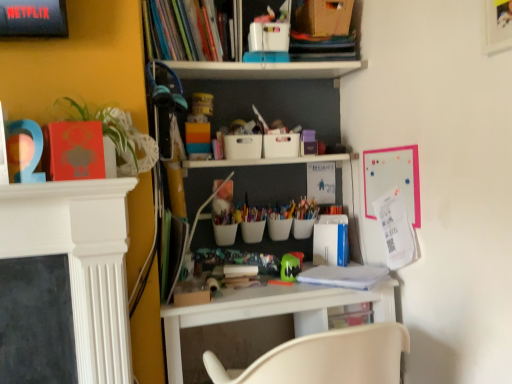
Image resolution: width=512 pixels, height=384 pixels. What do you see at coordinates (106, 126) in the screenshot?
I see `green leafy plant at left` at bounding box center [106, 126].

Describe the element at coordinates (344, 276) in the screenshot. I see `white paper at center, positioned as the 1th book in right-to-left order` at that location.

Where is `white plastic desk at center`? white plastic desk at center is located at coordinates (272, 311).

Is hardcover books at upper center, which ranks as the second book in bottom-to-top order, inside or outside of green rubber toy at center?

The correct answer is: outside.

Considering the sizes of objects hardcover books at upper center, which ranks as the second book in bottom-to-top order, and green rubber toy at center in the image provided, who is bigger, hardcover books at upper center, which ranks as the second book in bottom-to-top order, or green rubber toy at center?

With larger size is hardcover books at upper center, which ranks as the second book in bottom-to-top order.

Between point (207, 58) and point (288, 280), which one is positioned in front?

The point (288, 280) is in front.

Is hardcover books at upper center, which is the first book from left to right, taller or shorter than green rubber toy at center?

Clearly, hardcover books at upper center, which is the first book from left to right, is taller compared to green rubber toy at center.

Is point (308, 269) positioned in front of point (298, 263)?

No, it is not.

Based on the photo, from the image's perspective, which one is positioned lower, white paper at center, the second book from the left, or green rubber toy at center?

white paper at center, the second book from the left, from the image's perspective.

Is white paper at center, positioned as the 1th book in right-to-left order, smaller than green rubber toy at center?

No, white paper at center, positioned as the 1th book in right-to-left order, is not smaller than green rubber toy at center.

Considering the sizes of objects green leafy plant at left and hardcover books at upper center, which is the 1th book from top to bottom, in the image provided, who is smaller, green leafy plant at left or hardcover books at upper center, which is the 1th book from top to bottom,?

Smaller between the two is green leafy plant at left.

Is green leafy plant at left oriented towards hardcover books at upper center, which is the second book in right-to-left order?

No.

Can you confirm if green leafy plant at left is taller than hardcover books at upper center, which is the first book from left to right?

Incorrect, the height of green leafy plant at left is not larger of that of hardcover books at upper center, which is the first book from left to right.

Does green leafy plant at left have a greater width compared to hardcover books at upper center, which is the 1th book from top to bottom?

No.

Considering the sizes of objects white paper at center, which is the second book in top-to-bottom order, and green leafy plant at left in the image provided, who is wider, white paper at center, which is the second book in top-to-bottom order, or green leafy plant at left?

white paper at center, which is the second book in top-to-bottom order, is wider.

Is white paper at center, which is the second book in top-to-bottom order, further to camera compared to green leafy plant at left?

Yes, white paper at center, which is the second book in top-to-bottom order, is behind green leafy plant at left.

Is white paper at center, which is the second book in top-to-bottom order, turned away from green leafy plant at left?

No, white paper at center, which is the second book in top-to-bottom order, is not facing the opposite direction of green leafy plant at left.

Is white paper at center, positioned as the 1th book in right-to-left order, with green leafy plant at left?

white paper at center, positioned as the 1th book in right-to-left order, is not next to green leafy plant at left, and they're not touching.

From the picture: Measure the distance from white plastic desk at center to white paper at center, positioned as the 1th book in right-to-left order.

A distance of 6.87 inches exists between white plastic desk at center and white paper at center, positioned as the 1th book in right-to-left order.

Can you confirm if white plastic desk at center is smaller than white paper at center, positioned as the 1th book in right-to-left order?

No, white plastic desk at center is not smaller than white paper at center, positioned as the 1th book in right-to-left order.

From a real-world perspective, is white plastic desk at center above or below white paper at center, the first book from the bottom?

Clearly, from a real-world perspective, white plastic desk at center is below white paper at center, the first book from the bottom.

From the image's perspective, which object appears higher, white plastic desk at center or white paper at center, which is the second book in top-to-bottom order?

From the image's view, white paper at center, which is the second book in top-to-bottom order, is above.

From the image's perspective, would you say green rubber toy at center is shown under white plastic desk at center?

Incorrect, from the image's perspective, green rubber toy at center is higher than white plastic desk at center.

Which is in front, point (284, 262) or point (224, 309)?

The point (224, 309) is more forward.

Image resolution: width=512 pixels, height=384 pixels. Find the location of `toy on the right of white plastic desk at center`. toy on the right of white plastic desk at center is located at coordinates point(291,266).

Based on the photo, considering the sizes of objects green rubber toy at center and white plastic desk at center in the image provided, who is smaller, green rubber toy at center or white plastic desk at center?

Smaller between the two is green rubber toy at center.

Can you tell me how much hardcover books at upper center, which is the second book in right-to-left order, and white paper at center, the second book from the left, differ in facing direction?

hardcover books at upper center, which is the second book in right-to-left order, and white paper at center, the second book from the left, are facing 41.9 degrees away from each other.

Looking at this image, is hardcover books at upper center, which is the second book in right-to-left order, looking in the opposite direction of white paper at center, which is the second book in top-to-bottom order?

No.

Does hardcover books at upper center, which is the 1th book from top to bottom, have a lesser width compared to white paper at center, which is the second book in top-to-bottom order?

Yes.

Image resolution: width=512 pixels, height=384 pixels. Find the location of `book that is above the green rubber toy at center (from the image's perspective)`. book that is above the green rubber toy at center (from the image's perspective) is located at coordinates (186, 30).

Locate an element on the screen. The image size is (512, 384). book below the green rubber toy at center (from the image's perspective) is located at coordinates (344, 276).

Looking at the image, which one is located closer to white paper at center, the first book from the bottom, green leafy plant at left or green rubber toy at center?

green rubber toy at center lies closer to white paper at center, the first book from the bottom, than the other object.

Which object lies nearer to the anchor point white plastic desk at center, hardcover books at upper center, which is the 1th book from top to bottom, or green leafy plant at left?

green leafy plant at left lies closer to white plastic desk at center than the other object.

When comparing their distances from green rubber toy at center, does hardcover books at upper center, which is the 1th book from top to bottom, or white paper at center, the second book from the left, seem closer?

white paper at center, the second book from the left, is closer to green rubber toy at center.

Considering their positions, is hardcover books at upper center, which is the second book in right-to-left order, positioned further to green rubber toy at center than green leafy plant at left?

The object further to green rubber toy at center is hardcover books at upper center, which is the second book in right-to-left order.

Based on their spatial positions, is hardcover books at upper center, which is the second book in right-to-left order, or white paper at center, the second book from the left, further from green leafy plant at left?

white paper at center, the second book from the left, lies further to green leafy plant at left than the other object.

Based on their spatial positions, is white plastic desk at center or green leafy plant at left closer to hardcover books at upper center, which ranks as the second book in bottom-to-top order?

green leafy plant at left is closer to hardcover books at upper center, which ranks as the second book in bottom-to-top order.

Looking at the image, which one is located closer to hardcover books at upper center, which is the second book in right-to-left order, white plastic desk at center or white paper at center, which is the second book in top-to-bottom order?

white plastic desk at center is positioned closer to the anchor hardcover books at upper center, which is the second book in right-to-left order.

When comparing their distances from white plastic desk at center, does white paper at center, the second book from the left, or green rubber toy at center seem further?

green rubber toy at center is positioned further to the anchor white plastic desk at center.

Where is `toy located between green leafy plant at left and white paper at center, the first book from the bottom, in the left-right direction`? toy located between green leafy plant at left and white paper at center, the first book from the bottom, in the left-right direction is located at coordinates (291, 266).

The image size is (512, 384). Identify the location of toy between green leafy plant at left and white plastic desk at center from top to bottom. (291, 266).

This screenshot has height=384, width=512. I want to click on toy between hardcover books at upper center, which is the first book from left to right, and white paper at center, positioned as the 1th book in right-to-left order, in the up-down direction, so click(x=291, y=266).

Where is `book between hardcover books at upper center, which ranks as the second book in bottom-to-top order, and white plastic desk at center vertically`? Image resolution: width=512 pixels, height=384 pixels. book between hardcover books at upper center, which ranks as the second book in bottom-to-top order, and white plastic desk at center vertically is located at coordinates (344, 276).